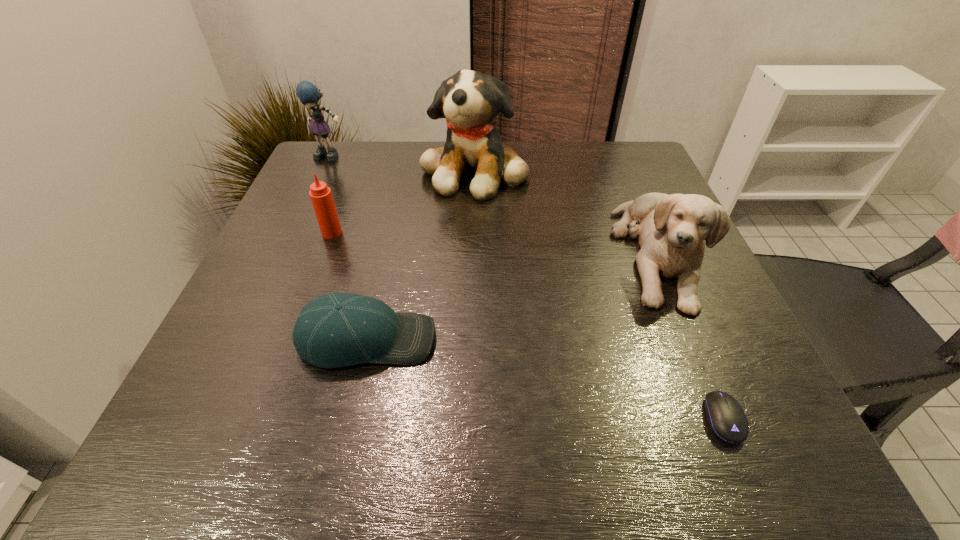
Image resolution: width=960 pixels, height=540 pixels. What are the coordinates of `free space located on the front-facing side of the leftmost object` in the screenshot? It's located at (293, 241).

Where is `free point located on the front-facing side of the third tallest object`? The width and height of the screenshot is (960, 540). free point located on the front-facing side of the third tallest object is located at coordinates (693, 341).

You are a GUI agent. You are given a task and a screenshot of the screen. Output one action in this format:
    pyautogui.click(x=<x>, y=<y>)
    Task: Click on the vacant region located 0.400m on the right of the fourth tallest object
    The image size is (960, 540).
    Given the screenshot: What is the action you would take?
    coord(523,233)

This screenshot has height=540, width=960. I want to click on free space located 0.350m on the back of the baseball cap, so click(398, 200).

The width and height of the screenshot is (960, 540). In order to click on vacant space located 0.050m on the right of the shortest object in this screenshot , I will do `click(775, 418)`.

Locate an element on the screen. The width and height of the screenshot is (960, 540). puppy that is at the far edge is located at coordinates (469, 100).

Where is `rag doll that is at the far edge`? The width and height of the screenshot is (960, 540). rag doll that is at the far edge is located at coordinates (307, 92).

I want to click on object present at the near edge, so click(x=725, y=416).

I want to click on rag doll at the left edge, so click(307, 92).

I want to click on Tabasco sauce that is positioned at the left edge, so click(x=321, y=197).